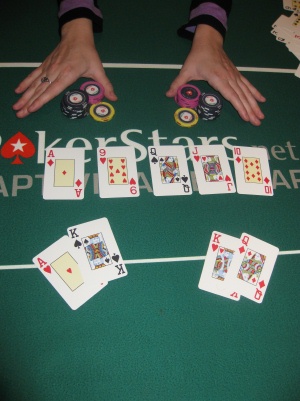
This screenshot has height=401, width=300. Identify the location of white border on table. (168, 258), (152, 65).